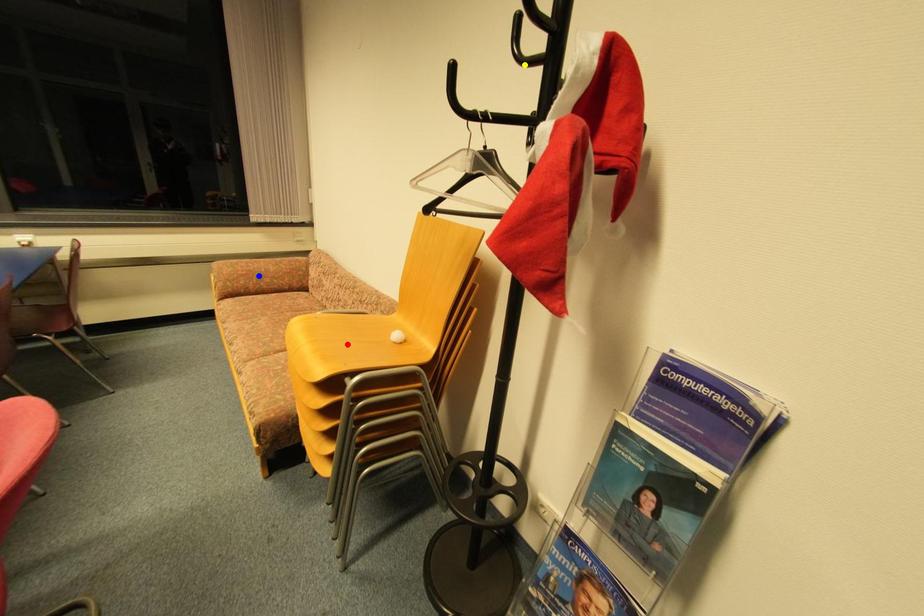
Order these from nearest to farthest:
yellow point
red point
blue point

blue point < red point < yellow point